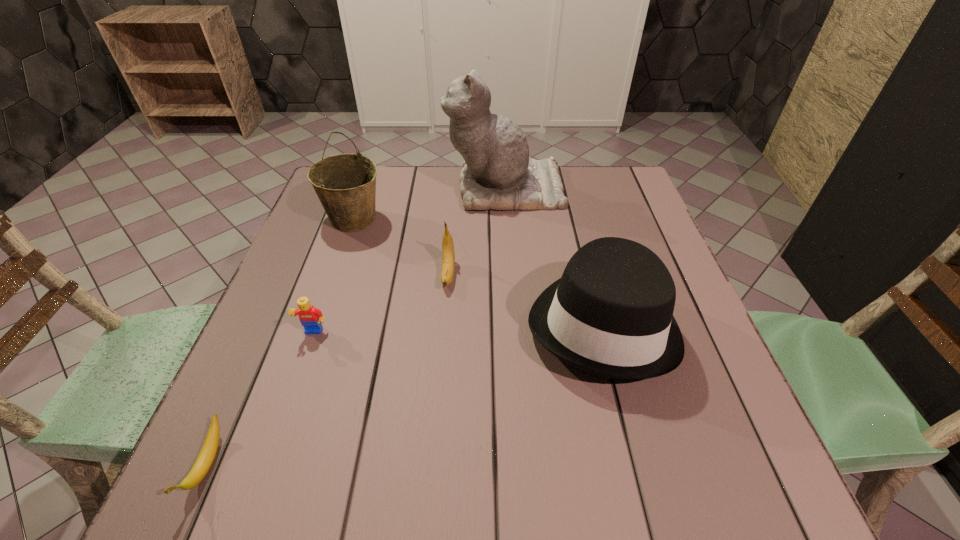
What are the coordinates of `banana that is positioned at the left edge` in the screenshot? It's located at (207, 454).

At what (x,y) coordinates should I click in order to perform the action: click on object at the right edge. Please return your answer as a coordinate pair (x, y). This screenshot has height=540, width=960. Looking at the image, I should click on (610, 314).

Find the location of a particular element. Image resolution: width=960 pixels, height=540 pixels. object that is at the far left corner is located at coordinates (345, 184).

This screenshot has height=540, width=960. What are the coordinates of `object positioned at the near left corner` in the screenshot? It's located at (207, 454).

Find the location of a particular element. Image resolution: width=960 pixels, height=540 pixels. vacant space at the far edge of the desktop is located at coordinates (409, 208).

In order to click on blank space at the near edge in this screenshot , I will do `click(447, 468)`.

Find the location of `free point at the left edge`. free point at the left edge is located at coordinates (316, 227).

This screenshot has width=960, height=540. Find the location of `free space at the right edge`. free space at the right edge is located at coordinates 696,327.

Locate an element on the screen. This screenshot has width=960, height=540. empty space between the farther banana and the fourth shortest object is located at coordinates (525, 299).

Where is `free spot between the tallest object and the right banana`? The width and height of the screenshot is (960, 540). free spot between the tallest object and the right banana is located at coordinates (476, 231).